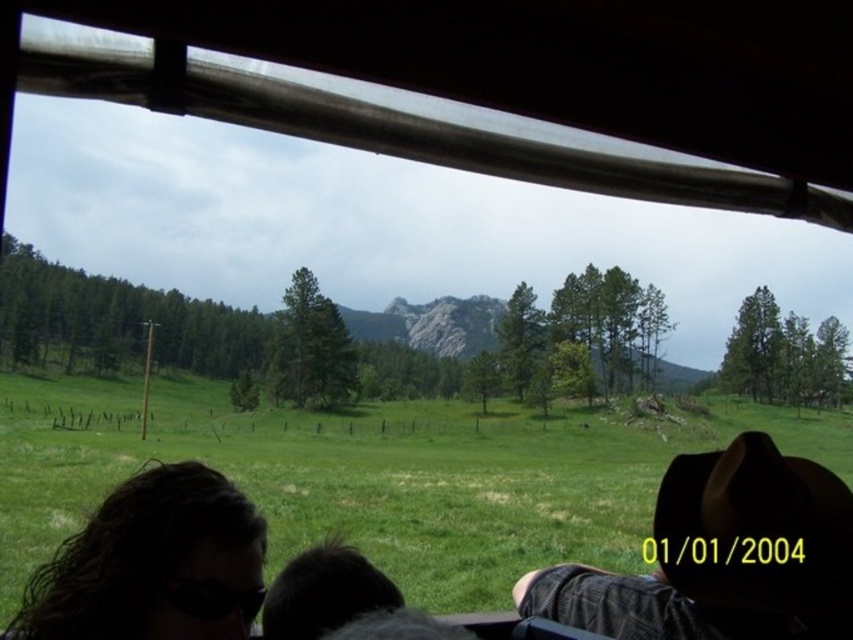
Can you confirm if brown felt hat at lower right is smaller than black fur at lower center?

No, brown felt hat at lower right is not smaller than black fur at lower center.

Can you confirm if brown felt hat at lower right is wider than black fur at lower center?

Correct, the width of brown felt hat at lower right exceeds that of black fur at lower center.

Identify the location of brown felt hat at lower right. (722, 556).

Can you confirm if dark hair at lower left is positioned below black fur at lower center?

Indeed, dark hair at lower left is positioned under black fur at lower center.

Describe the element at coordinates (154, 564) in the screenshot. I see `dark hair at lower left` at that location.

Where is `dark hair at lower left`? The height and width of the screenshot is (640, 853). dark hair at lower left is located at coordinates (154, 564).

Is brown felt hat at lower right wider than dark hair at lower left?

No.

Is brown felt hat at lower right to the right of dark hair at lower left from the viewer's perspective?

Yes, brown felt hat at lower right is to the right of dark hair at lower left.

Locate an element on the screen. This screenshot has height=640, width=853. brown felt hat at lower right is located at coordinates (722, 556).